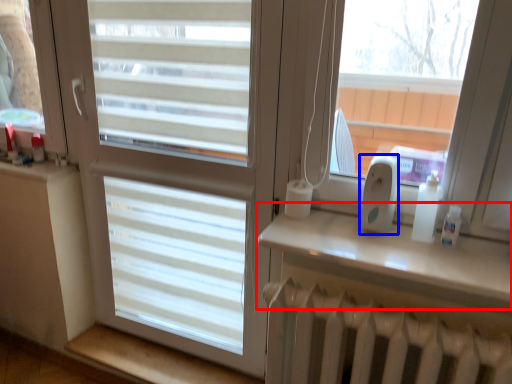
Question: Which point is further to the camera, window sill (highlighted by a red box) or ipod (highlighted by a blue box)?

Choices:
 (A) window sill
 (B) ipod

Answer: (B)